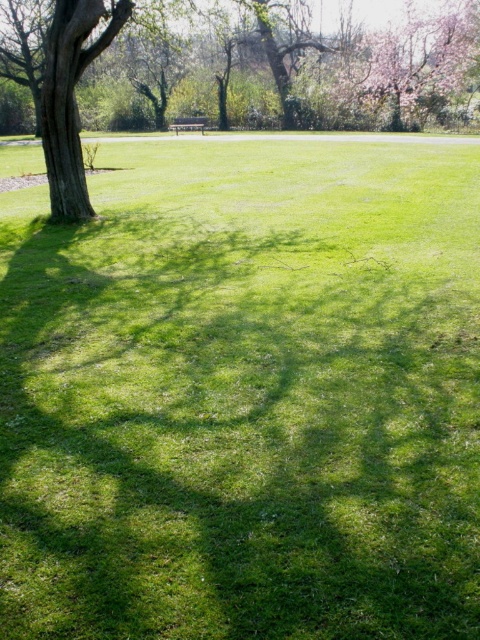
Based on the photo, you are planning to take a photo of the wooden park bench at center while standing behind the green leafy tree at left. Will the tree block your view of the bench?

The green leafy tree at left is in front of the wooden park bench at center, so standing behind the tree would block your view of the bench.